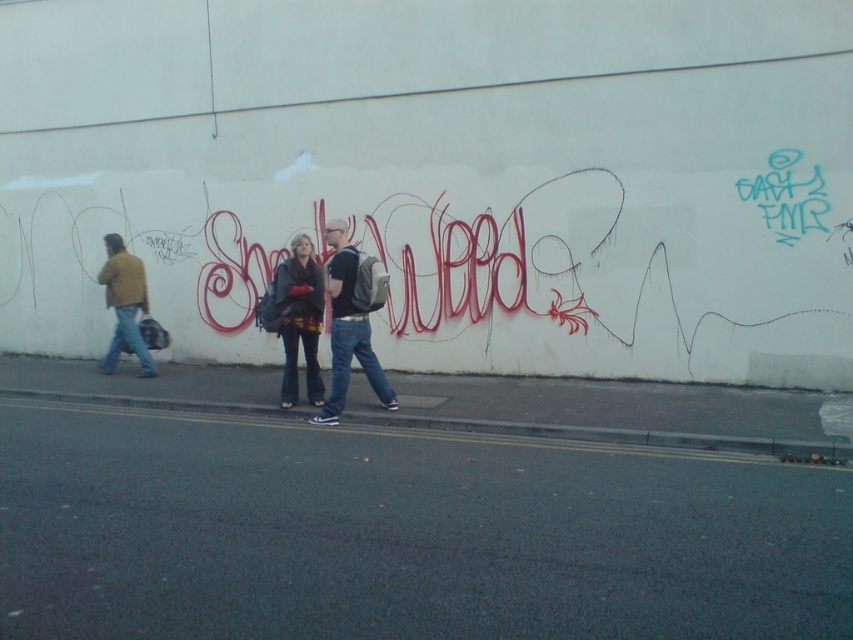
Question: Can you confirm if matte black backpack at center is positioned above matte black jacket at center?

Choices:
 (A) yes
 (B) no

Answer: (B)

Question: Is matte black backpack at center to the left of matte yellow jacket at left from the viewer's perspective?

Choices:
 (A) no
 (B) yes

Answer: (A)

Question: Which point appears farthest from the camera in this image?

Choices:
 (A) (345, 273)
 (B) (120, 344)
 (C) (300, 289)

Answer: (B)

Question: Among these points, which one is nearest to the camera?

Choices:
 (A) (312, 396)
 (B) (383, 394)
 (C) (112, 304)

Answer: (B)

Question: Among these points, which one is nearest to the camera?

Choices:
 (A) (119, 317)
 (B) (281, 321)

Answer: (B)

Question: Does matte black backpack at center come in front of matte yellow jacket at left?

Choices:
 (A) yes
 (B) no

Answer: (A)